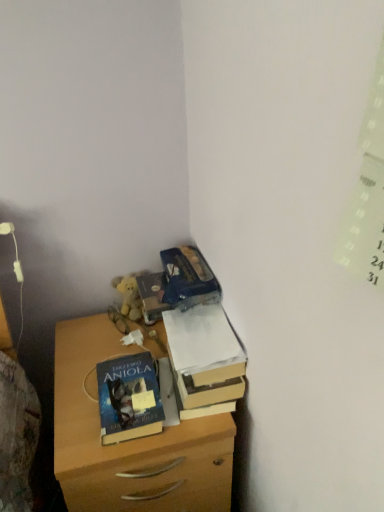
At what (x,y) coordinates should I click in order to perform the action: click on free space behind blue matte book at center. Please return your answer as a coordinate pair (x, y). The width and height of the screenshot is (384, 512). Looking at the image, I should click on point(109,347).